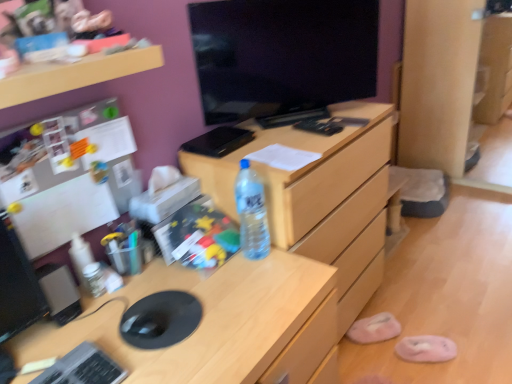
This screenshot has width=512, height=384. In order to click on clear wood file cabinet at center in this screenshot , I will do `click(320, 196)`.

Measure the distance between wooden desk at center and camera.

wooden desk at center is 37.18 inches away from camera.

This screenshot has height=384, width=512. What are the coordinates of `translucent plastic water bottle at center` in the screenshot? It's located at (251, 213).

Is silver metallic keyboard at lower left oriented towards clear wood file cabinet at center?

No, silver metallic keyboard at lower left is not facing towards clear wood file cabinet at center.

From a real-world perspective, is silver metallic keyboard at lower left located higher than clear wood file cabinet at center?

Yes, from a real-world perspective, silver metallic keyboard at lower left is above clear wood file cabinet at center.

In the image, is silver metallic keyboard at lower left positioned in front of or behind clear wood file cabinet at center?

In the image, silver metallic keyboard at lower left appears in front of clear wood file cabinet at center.

From the picture: Measure the distance from silver metallic keyboard at lower left to clear wood file cabinet at center.

silver metallic keyboard at lower left and clear wood file cabinet at center are 3.45 feet apart.

Can you confirm if wooden desk at center is positioned to the left of silver metallic keyboard at lower left?

No.

Can you tell me how much wooden desk at center and silver metallic keyboard at lower left differ in facing direction?

They differ by 0.0602 degrees in their facing directions.

Which point is more forward, (251, 369) or (72, 362)?

The point (72, 362) is closer.

Considering the relative sizes of wooden desk at center and silver metallic keyboard at lower left in the image provided, is wooden desk at center wider than silver metallic keyboard at lower left?

Correct, the width of wooden desk at center exceeds that of silver metallic keyboard at lower left.

Is translucent plastic water bottle at center positioned with its back to wooden desk at center?

translucent plastic water bottle at center does not have its back to wooden desk at center.

Is translucent plastic water bottle at center directly adjacent to wooden desk at center?

No, translucent plastic water bottle at center is not with wooden desk at center.

From the image's perspective, which object appears higher, translucent plastic water bottle at center or wooden desk at center?

translucent plastic water bottle at center is shown above in the image.

Relative to wooden desk at center, is translucent plastic water bottle at center in front or behind?

Clearly, translucent plastic water bottle at center is behind wooden desk at center.

Is pink fuzzy slipper at lower right, marked as the second slipper in a back-to-front arrangement, next to wooden shelf at upper left and touching it?

No, pink fuzzy slipper at lower right, marked as the second slipper in a back-to-front arrangement, is not in contact with wooden shelf at upper left.

Which object is further away from the camera, pink fuzzy slipper at lower right, the 2th slipper positioned from the left, or wooden shelf at upper left?

pink fuzzy slipper at lower right, the 2th slipper positioned from the left, is further away from the camera.

Between point (443, 350) and point (123, 76), which one is positioned in front?

The point (123, 76) is more forward.

Between pink fuzzy slipper at lower right, marked as the second slipper in a back-to-front arrangement, and wooden shelf at upper left, which one has larger size?

With larger size is wooden shelf at upper left.

Does translucent plastic water bottle at center lie behind pink fuzzy slipper at lower right, marked as the second slipper in a back-to-front arrangement?

That is False.

Does translucent plastic water bottle at center appear on the left side of pink fuzzy slipper at lower right, the 2th slipper positioned from the left?

Indeed, translucent plastic water bottle at center is positioned on the left side of pink fuzzy slipper at lower right, the 2th slipper positioned from the left.

Does translucent plastic water bottle at center contain pink fuzzy slipper at lower right, marked as the second slipper in a back-to-front arrangement?

No, pink fuzzy slipper at lower right, marked as the second slipper in a back-to-front arrangement, is not surrounded by translucent plastic water bottle at center.

Considering the positions of point (239, 196) and point (348, 332), is point (239, 196) closer or farther from the camera than point (348, 332)?

Point (239, 196) appears to be closer to the viewer than point (348, 332).

Which object is wider, translucent plastic water bottle at center or pink fabric slipper at lower right, acting as the 2th slipper starting from the front?

Wider between the two is pink fabric slipper at lower right, acting as the 2th slipper starting from the front.

Is translucent plastic water bottle at center positioned beyond the bounds of pink fabric slipper at lower right, which appears as the 1th slipper when viewed from the back?

That's correct, translucent plastic water bottle at center is outside of pink fabric slipper at lower right, which appears as the 1th slipper when viewed from the back.

Who is more distant, translucent plastic water bottle at center or pink fabric slipper at lower right, acting as the 2th slipper starting from the front?

pink fabric slipper at lower right, acting as the 2th slipper starting from the front, is behind.

Measure the distance between wooden desk at center and wooden shelf at upper left.

wooden desk at center and wooden shelf at upper left are 26.51 inches apart from each other.

From a real-world perspective, is wooden desk at center physically above wooden shelf at upper left?

No, from a real-world perspective, wooden desk at center is not on top of wooden shelf at upper left.

Considering the relative positions of wooden desk at center and wooden shelf at upper left in the image provided, is wooden desk at center in front of wooden shelf at upper left?

Yes, it is.

Is wooden shelf at upper left located within wooden desk at center?

Actually, wooden shelf at upper left is outside wooden desk at center.

I want to click on keyboard on the left of clear wood file cabinet at center, so coord(83,368).

The height and width of the screenshot is (384, 512). In order to click on desk located behind the silver metallic keyboard at lower left in this screenshot , I will do `click(212, 322)`.

Based on their spatial positions, is wooden shelf at upper left or wooden desk at center further from clear wood file cabinet at center?

Based on the image, wooden shelf at upper left appears to be further to clear wood file cabinet at center.

Estimate the real-world distances between objects in this image. Which object is further from wooden desk at center, translucent plastic water bottle at center or pink fuzzy slipper at lower right, the 2th slipper positioned from the left?

Among the two, pink fuzzy slipper at lower right, the 2th slipper positioned from the left, is located further to wooden desk at center.

Estimate the real-world distances between objects in this image. Which object is closer to wooden shelf at upper left, wooden desk at center or pink fuzzy slipper at lower right, the 2th slipper positioned from the left?

Based on the image, wooden desk at center appears to be nearer to wooden shelf at upper left.

Looking at the image, which one is located further to translucent plastic water bottle at center, pink fuzzy slipper at lower right, marked as the second slipper in a back-to-front arrangement, or wooden desk at center?

The object further to translucent plastic water bottle at center is pink fuzzy slipper at lower right, marked as the second slipper in a back-to-front arrangement.

Considering their positions, is pink fuzzy slipper at lower right, the 2th slipper positioned from the left, positioned closer to black glossy monitor at center than wooden desk at center?

wooden desk at center is positioned closer to the anchor black glossy monitor at center.

Which object lies nearer to the anchor point pink fuzzy slipper at lower right, marked as the 1th slipper in a front-to-back arrangement, clear wood file cabinet at center or wooden shelf at upper left?

Based on the image, clear wood file cabinet at center appears to be nearer to pink fuzzy slipper at lower right, marked as the 1th slipper in a front-to-back arrangement.

Considering their positions, is pink fabric slipper at lower right, which appears as the 1th slipper when viewed from the back, positioned further to translucent plastic water bottle at center than black glossy monitor at center?

pink fabric slipper at lower right, which appears as the 1th slipper when viewed from the back, is positioned further to the anchor translucent plastic water bottle at center.

Which object lies further to the anchor point pink fuzzy slipper at lower right, the 2th slipper positioned from the left, wooden desk at center or black glossy monitor at center?

black glossy monitor at center lies further to pink fuzzy slipper at lower right, the 2th slipper positioned from the left, than the other object.

I want to click on bottle situated between wooden shelf at upper left and black glossy monitor at center from left to right, so click(251, 213).

The height and width of the screenshot is (384, 512). I want to click on bottle that lies between black glossy monitor at center and clear wood file cabinet at center from top to bottom, so click(x=251, y=213).

Where is `file cabinet between black glossy monitor at center and silver metallic keyboard at lower left from top to bottom`? The width and height of the screenshot is (512, 384). file cabinet between black glossy monitor at center and silver metallic keyboard at lower left from top to bottom is located at coordinates (320, 196).

This screenshot has height=384, width=512. In order to click on keyboard between wooden shelf at upper left and wooden desk at center in the up-down direction in this screenshot , I will do `click(83, 368)`.